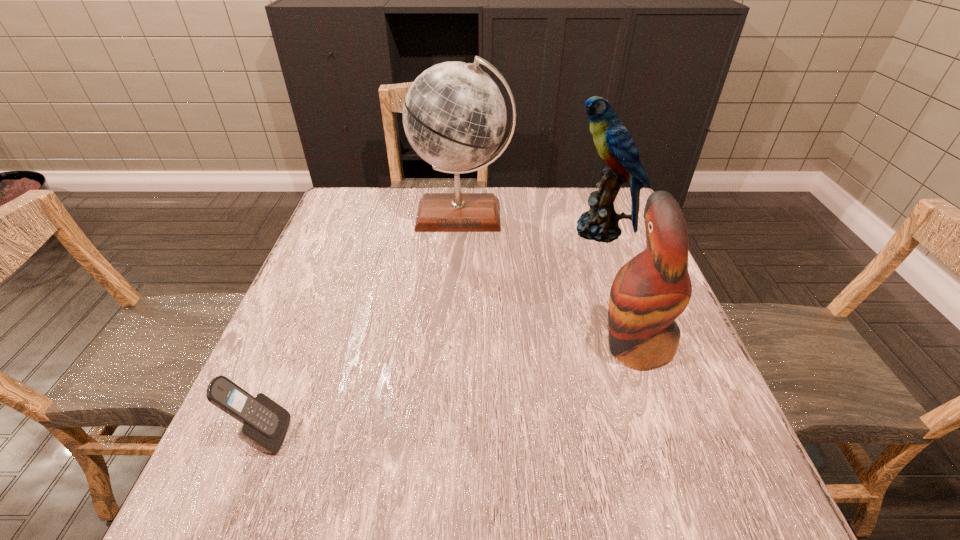
Locate an element on the screen. The width and height of the screenshot is (960, 540). vacant space located 0.300m on the face of the second nearest object is located at coordinates (451, 345).

Where is `vacant space located 0.260m on the face of the second nearest object`? vacant space located 0.260m on the face of the second nearest object is located at coordinates (471, 345).

Identify the location of free space located on the face of the second nearest object. Image resolution: width=960 pixels, height=540 pixels. (505, 345).

This screenshot has width=960, height=540. Find the location of `free location located 0.390m on the front-facing side of the cellular telephone`. free location located 0.390m on the front-facing side of the cellular telephone is located at coordinates (513, 435).

Find the location of `globe that is at the far edge`. globe that is at the far edge is located at coordinates (454, 115).

At what (x,y) coordinates should I click in order to perform the action: click on parrot positioned at the far edge. Please return your answer as a coordinate pair (x, y). Looking at the image, I should click on (614, 144).

Where is `object that is at the left edge`? object that is at the left edge is located at coordinates (265, 423).

Find the location of `object located at the far right corner`. object located at the far right corner is located at coordinates pyautogui.click(x=614, y=144).

Identify the location of vacant region at the far edge of the desktop. The width and height of the screenshot is (960, 540). (540, 198).

Image resolution: width=960 pixels, height=540 pixels. What are the coordinates of `vacant region at the near edge of the desktop` in the screenshot? It's located at (308, 481).